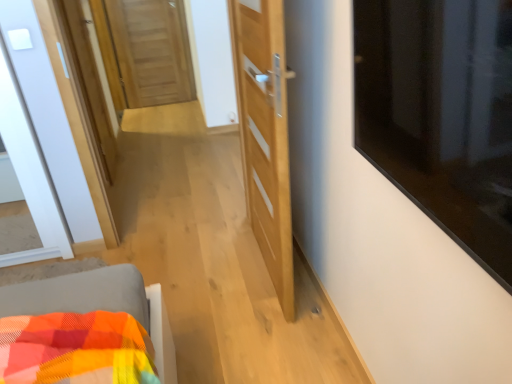
The image size is (512, 384). What are the coordinates of `free space in front of light wood door at center, arranged as the first door when ordered from the bottom` in the screenshot? It's located at (259, 327).